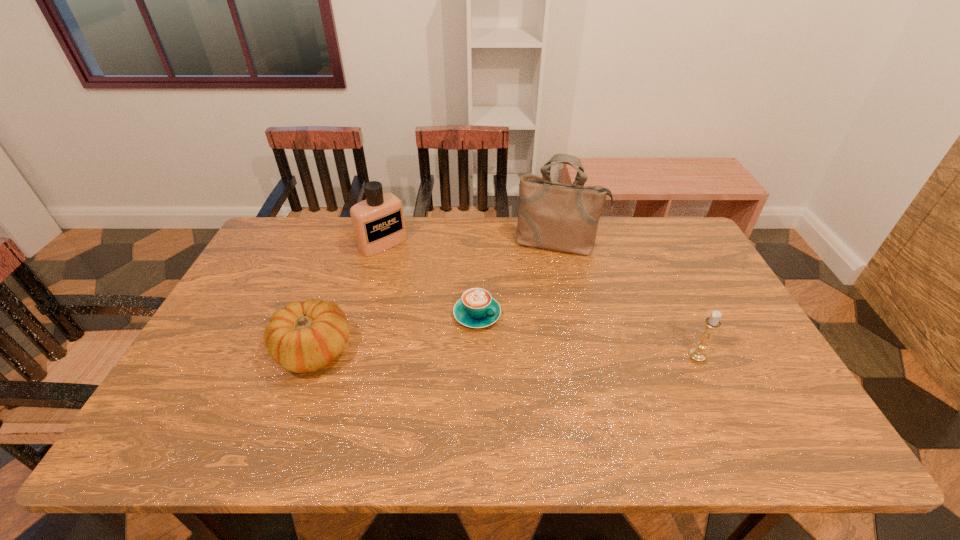
Image resolution: width=960 pixels, height=540 pixels. Find the location of `perfume at the far edge`. perfume at the far edge is located at coordinates (x=378, y=222).

Locate an element on the screen. The height and width of the screenshot is (540, 960). object present at the near edge is located at coordinates (305, 337).

Find the location of a particular element. object at the right edge is located at coordinates (712, 323).

Where is `vacant area at the far edge of the desktop`? vacant area at the far edge of the desktop is located at coordinates (501, 217).

The width and height of the screenshot is (960, 540). What are the coordinates of `vacant area at the near edge of the desktop` in the screenshot? It's located at (657, 411).

The width and height of the screenshot is (960, 540). In the image, there is a desktop. Identify the location of vacant space at the left edge. (265, 299).

The image size is (960, 540). I want to click on vacant space at the right edge of the desktop, so click(685, 277).

You are a GUI agent. You are given a task and a screenshot of the screen. Output one action in this format:
    pyautogui.click(x=<x>, y=<y>)
    Task: Click on the vacant region at the far left corner
    This screenshot has height=540, width=960.
    Given the screenshot: What is the action you would take?
    pyautogui.click(x=271, y=232)

You are a GUI agent. You are given a task and a screenshot of the screen. Output one action in this format:
    pyautogui.click(x=<x>, y=<y>)
    Task: Click on the free spot between the fourth tallest object and the shortest object
    The height and width of the screenshot is (540, 960).
    Given the screenshot: What is the action you would take?
    pyautogui.click(x=396, y=333)

Locate an element on the screen. This screenshot has width=960, height=540. vacant space in between the rightmost object and the gourd is located at coordinates (505, 353).